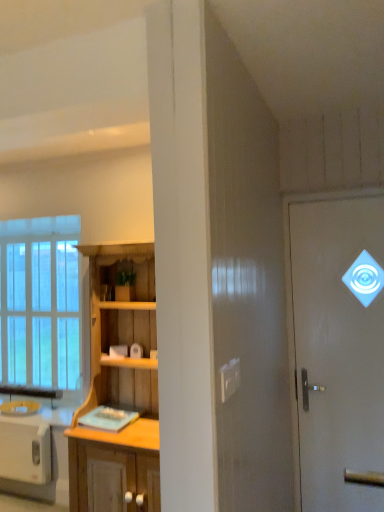
Question: Is white glossy door at upper right far away from clear glass window at left?

Choices:
 (A) yes
 (B) no

Answer: (A)

Question: Is white glossy door at upper right to the left of clear glass window at left from the viewer's perspective?

Choices:
 (A) no
 (B) yes

Answer: (A)

Question: Is the surface of white glossy door at upper right in direct contact with clear glass window at left?

Choices:
 (A) no
 (B) yes

Answer: (A)

Question: From a real-world perspective, is white glossy door at upper right located higher than clear glass window at left?

Choices:
 (A) no
 (B) yes

Answer: (A)

Question: Considering the relative positions of white glossy door at upper right and clear glass window at left in the image provided, is white glossy door at upper right to the right of clear glass window at left from the viewer's perspective?

Choices:
 (A) no
 (B) yes

Answer: (B)

Question: Does white glossy door at upper right contain clear glass window at left?

Choices:
 (A) yes
 (B) no

Answer: (B)

Question: Is white glossy toaster at lower left beside clear glass window at left?

Choices:
 (A) yes
 (B) no

Answer: (B)

Question: Does white glossy toaster at lower left have a greater width compared to clear glass window at left?

Choices:
 (A) yes
 (B) no

Answer: (A)

Question: Is white glossy toaster at lower left at the right side of clear glass window at left?

Choices:
 (A) no
 (B) yes

Answer: (B)

Question: From a real-world perspective, is white glossy toaster at lower left on top of clear glass window at left?

Choices:
 (A) no
 (B) yes

Answer: (A)

Question: Does white glossy toaster at lower left turn towards clear glass window at left?

Choices:
 (A) yes
 (B) no

Answer: (B)

Question: Considering the relative sizes of white glossy toaster at lower left and clear glass window at left in the image provided, is white glossy toaster at lower left shorter than clear glass window at left?

Choices:
 (A) yes
 (B) no

Answer: (A)

Question: Is clear glass window at left aimed at wooden cabinet at center?

Choices:
 (A) yes
 (B) no

Answer: (B)